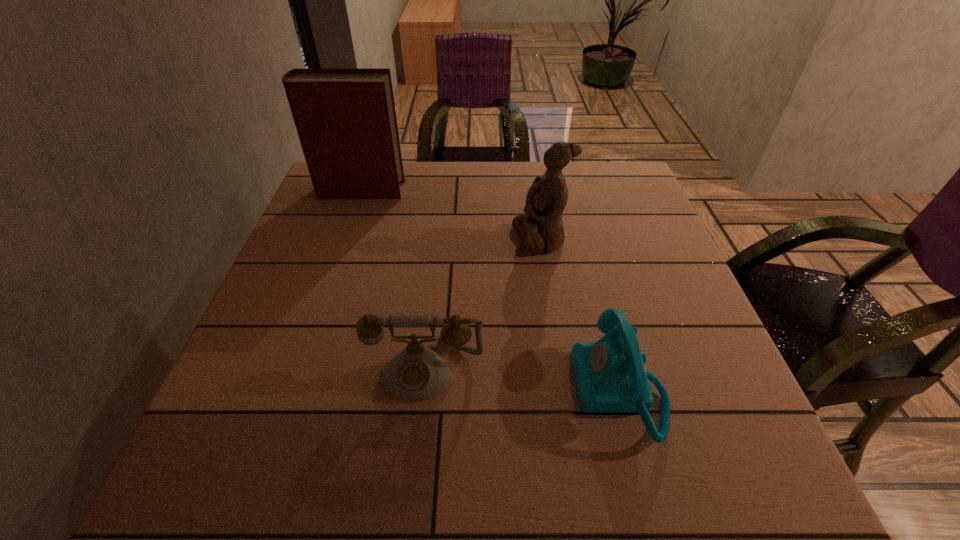
This screenshot has width=960, height=540. I want to click on blank space located on the dial of the left telephone, so click(415, 468).

Where is `vacant area situated 0.380m on the dial of the right telephone`? vacant area situated 0.380m on the dial of the right telephone is located at coordinates (355, 389).

You are a GUI agent. You are given a task and a screenshot of the screen. Output one action in this format:
    pyautogui.click(x=<x>, y=<y>)
    Task: Click on the free space located on the dial of the right telephone
    This screenshot has width=960, height=540.
    Given the screenshot: What is the action you would take?
    pyautogui.click(x=384, y=389)

Find the location of a particular element. The width and height of the screenshot is (960, 540). vacant area situated on the dial of the right telephone is located at coordinates (447, 389).

The width and height of the screenshot is (960, 540). I want to click on object at the far edge, so click(345, 118).

This screenshot has height=540, width=960. I want to click on object that is at the near edge, so click(x=610, y=377).

Locate an element on the screen. The image size is (960, 540). object that is at the left edge is located at coordinates tap(345, 118).

Locate an element on the screen. object located in the right edge section of the desktop is located at coordinates (610, 377).

This screenshot has width=960, height=540. I want to click on object that is positioned at the far left corner, so click(x=345, y=118).

In order to click on object that is at the near right corner in this screenshot , I will do `click(610, 377)`.